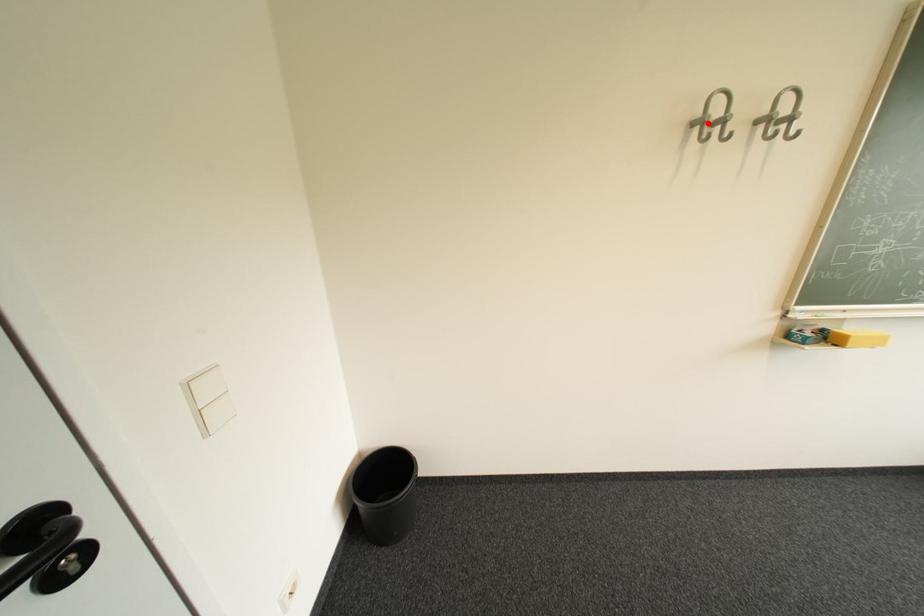
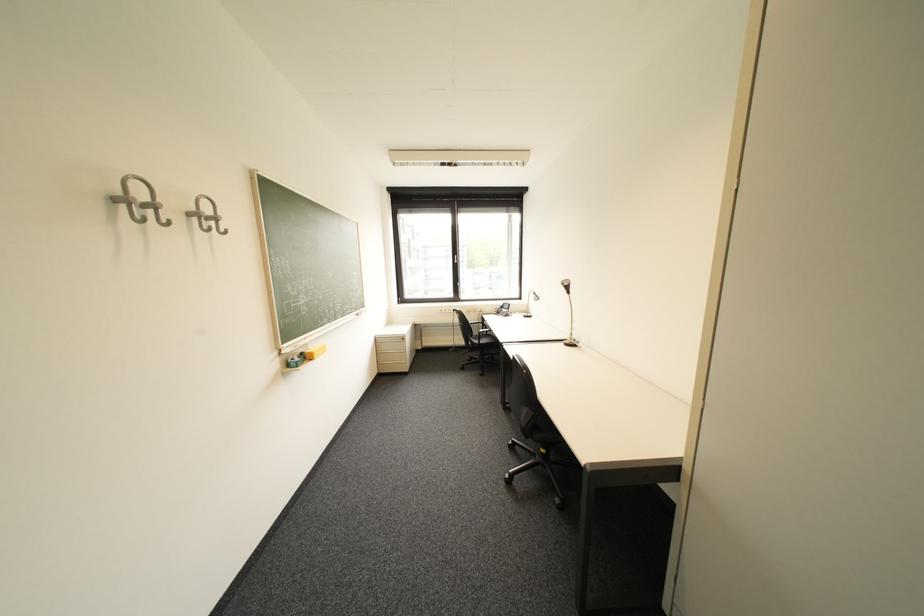
The point at the highlighted location is marked in the first image. Where is the corresponding point in the second image?

(130, 201)